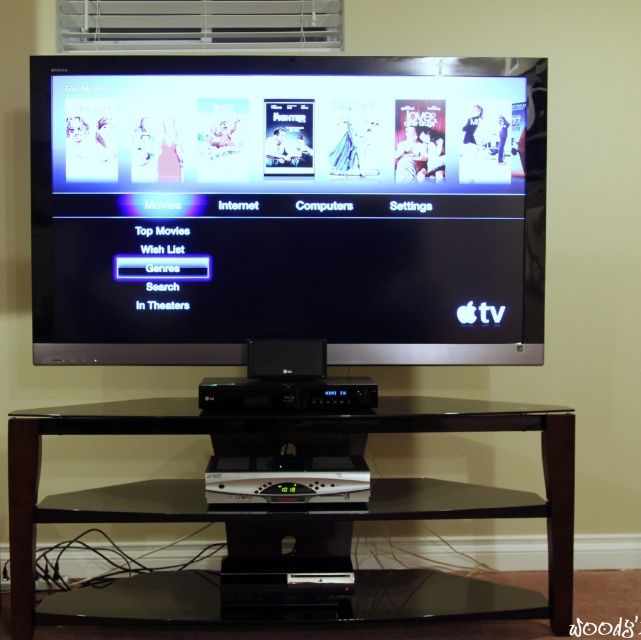
Question: Can you confirm if black glossy screen at upper center is positioned below black glass table at center?

Choices:
 (A) yes
 (B) no

Answer: (B)

Question: Does black glossy screen at upper center come behind black glass table at center?

Choices:
 (A) no
 (B) yes

Answer: (B)

Question: Which point is farther from the camera taking this photo?

Choices:
 (A) (420, 483)
 (B) (404, 141)

Answer: (A)

Question: Among these objects, which one is nearest to the camera?

Choices:
 (A) black glass table at center
 (B) black glossy screen at upper center

Answer: (A)

Question: Is black glossy screen at upper center smaller than black glass table at center?

Choices:
 (A) no
 (B) yes

Answer: (B)